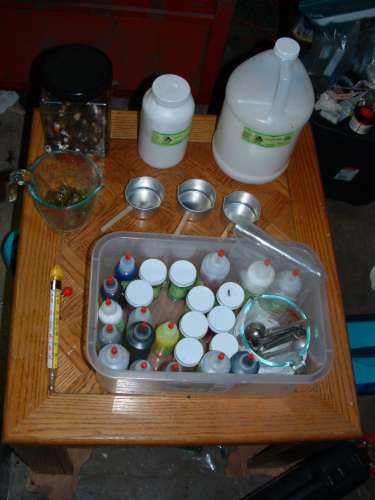
Locate an element on the screen. The image size is (375, 500). old cabinet is located at coordinates (168, 48).